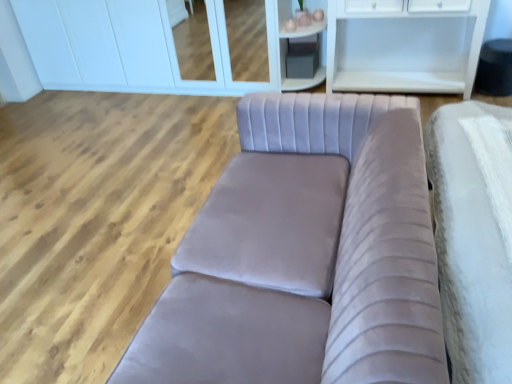
Question: Considering the relative sizes of white glossy cabinet at upper center and velvet grey couch at center in the image provided, is white glossy cabinet at upper center smaller than velvet grey couch at center?

Choices:
 (A) no
 (B) yes

Answer: (A)

Question: Is velvet grey couch at center inside white glossy cabinet at upper center?

Choices:
 (A) no
 (B) yes

Answer: (A)

Question: Is white glossy cabinet at upper center thinner than velvet grey couch at center?

Choices:
 (A) no
 (B) yes

Answer: (B)

Question: Is white glossy cabinet at upper center positioned with its back to velvet grey couch at center?

Choices:
 (A) no
 (B) yes

Answer: (A)

Question: Is white glossy cabinet at upper center to the left of velvet grey couch at center from the viewer's perspective?

Choices:
 (A) yes
 (B) no

Answer: (A)

Question: From the image's perspective, is white glossy cabinet at upper center located above or below velvet grey couch at center?

Choices:
 (A) below
 (B) above

Answer: (B)

Question: Considering the positions of white glossy cabinet at upper center and velvet grey couch at center in the image, is white glossy cabinet at upper center bigger or smaller than velvet grey couch at center?

Choices:
 (A) small
 (B) big

Answer: (B)

Question: Do you think white glossy cabinet at upper center is within velvet grey couch at center, or outside of it?

Choices:
 (A) outside
 (B) inside

Answer: (A)

Question: Considering the positions of white glossy cabinet at upper center and velvet grey couch at center in the image, is white glossy cabinet at upper center taller or shorter than velvet grey couch at center?

Choices:
 (A) short
 (B) tall

Answer: (B)

Question: In terms of width, does velvet grey couch at center look wider or thinner when compared to matte gray cube at upper center?

Choices:
 (A) wide
 (B) thin

Answer: (A)

Question: From their relative heights in the image, would you say velvet grey couch at center is taller or shorter than matte gray cube at upper center?

Choices:
 (A) short
 (B) tall

Answer: (A)

Question: In terms of size, does velvet grey couch at center appear bigger or smaller than matte gray cube at upper center?

Choices:
 (A) small
 (B) big

Answer: (B)

Question: In the image, is velvet grey couch at center positioned in front of or behind matte gray cube at upper center?

Choices:
 (A) front
 (B) behind

Answer: (A)

Question: Looking at the image, does white glossy cabinet at upper center seem bigger or smaller compared to matte gray cube at upper center?

Choices:
 (A) small
 (B) big

Answer: (B)

Question: Is white glossy cabinet at upper center taller or shorter than matte gray cube at upper center?

Choices:
 (A) tall
 (B) short

Answer: (A)